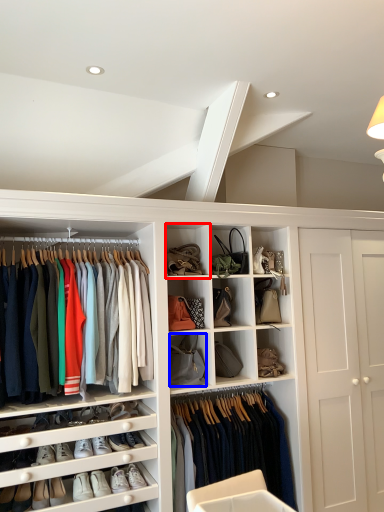
Question: Which of the following is the closest to the observer, cabinet (highlighted by a red box) or accessory (highlighted by a blue box)?

Choices:
 (A) cabinet
 (B) accessory

Answer: (A)